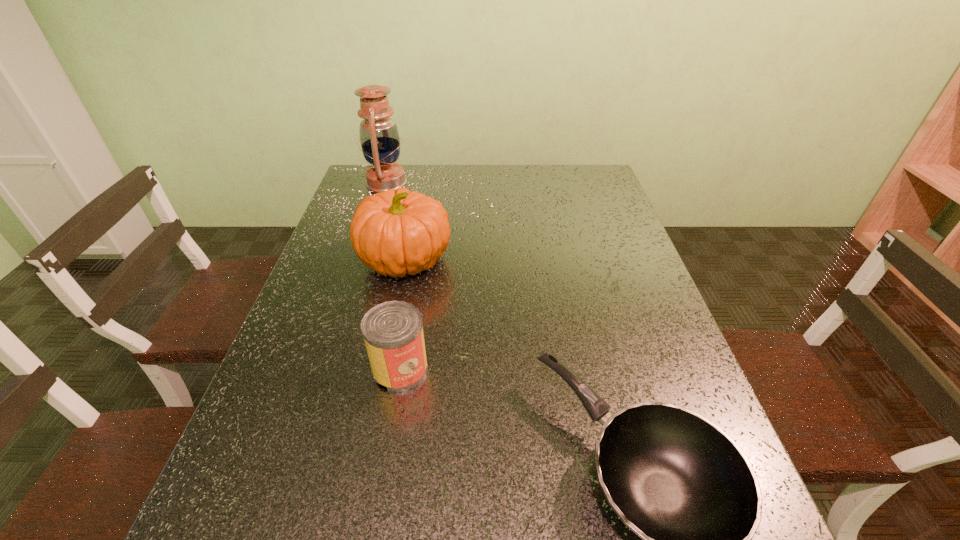
Image resolution: width=960 pixels, height=540 pixels. I want to click on oil lamp, so click(379, 138).

I want to click on the tallest object, so click(379, 138).

Find the location of a particular element. This screenshot has height=540, width=960. the third nearest object is located at coordinates (396, 232).

Where is `pumpkin`? pumpkin is located at coordinates (396, 232).

The width and height of the screenshot is (960, 540). I want to click on the third tallest object, so click(392, 330).

Find the location of a particular element. vacant area located on the right of the tallest object is located at coordinates (421, 182).

In order to click on free spot located on the surface of the pumpkin in this screenshot , I will do `click(587, 260)`.

Image resolution: width=960 pixels, height=540 pixels. What are the coordinates of `vacant region located 0.290m on the right of the can` in the screenshot? It's located at (569, 369).

Identify the location of object at the far edge. Image resolution: width=960 pixels, height=540 pixels. (379, 138).

Locate an element on the screen. The width and height of the screenshot is (960, 540). oil lamp that is at the left edge is located at coordinates (379, 138).